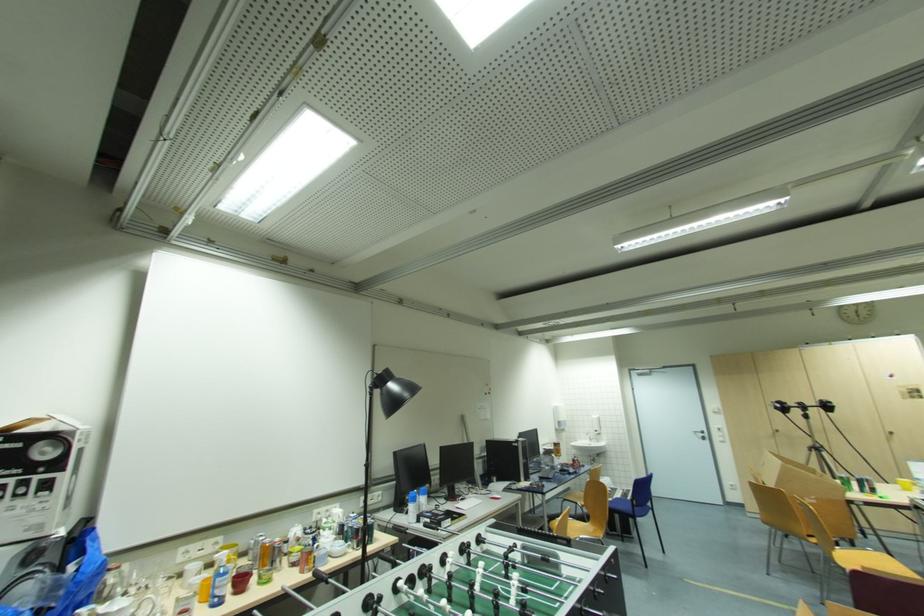
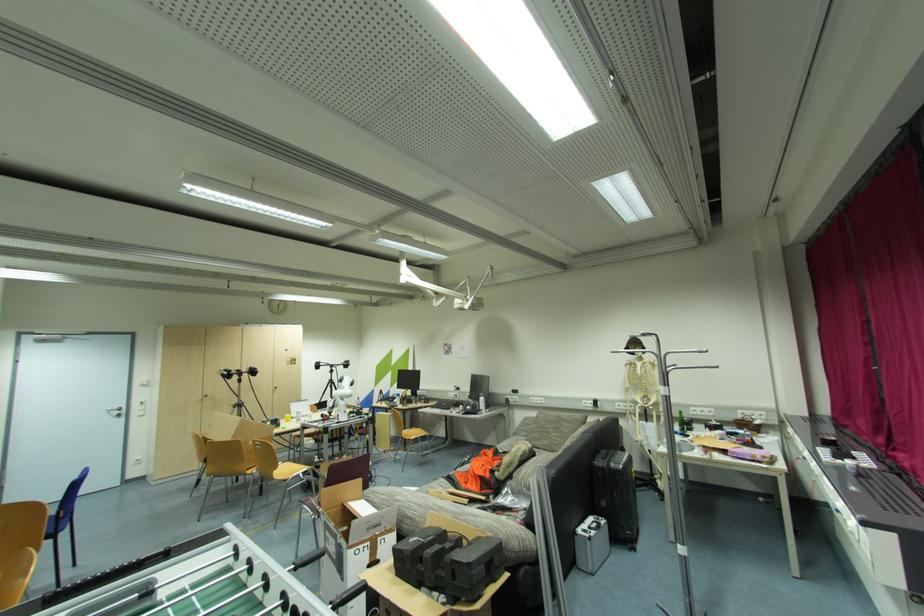
Locate, in the second image, the point that corresponds to point 817,541 in the first image.

(252, 472)